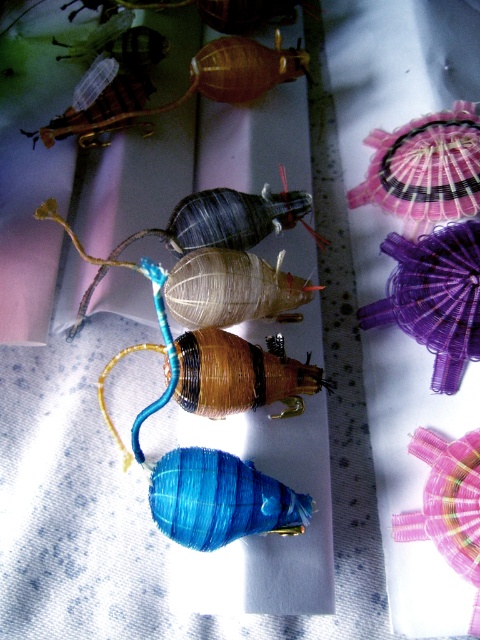
You are an artist who wants to place a small decorative item on your desk. You have the matte blue spool at center and the translucent amber shell at upper center. Which object should you choose if you want something smaller?

You should choose the translucent amber shell at upper center because it is smaller than the matte blue spool at center.

You are an artist arranging two items on a display shelf. You have a matte blue spool at center and a translucent amber shell at upper center. According to the scene, which item should you place to the left side of the shelf to maintain the original arrangement?

The translucent amber shell at upper center should be placed on the left side of the shelf because in the original arrangement, the matte blue spool at center is to the right of the translucent amber shell at upper center.